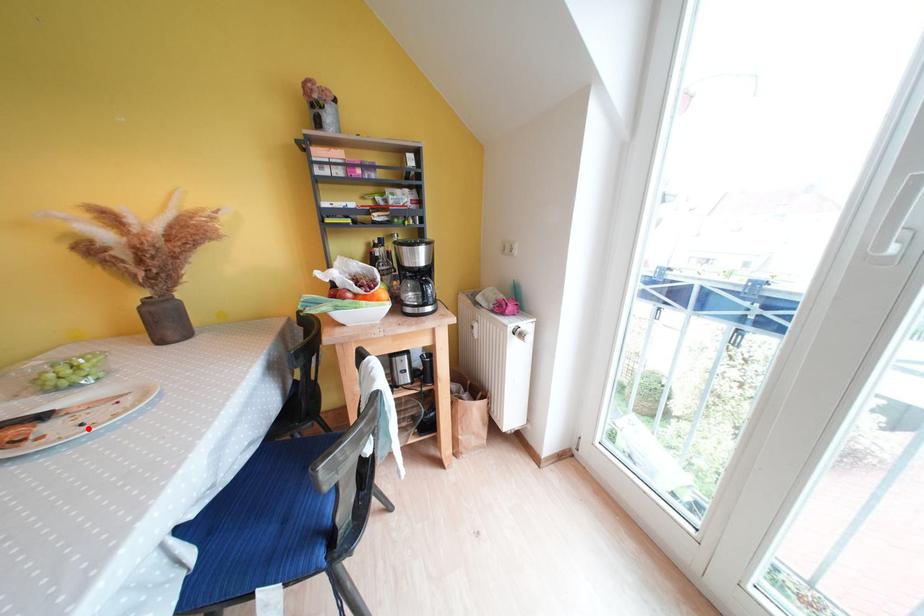
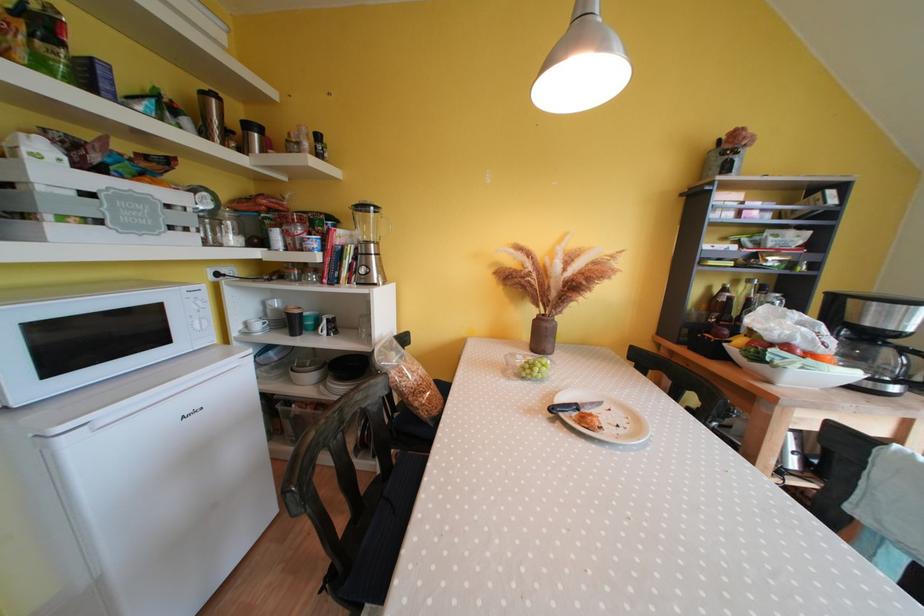
Find the pixel in the second image that matches the highlighted location in the first image.

(624, 430)